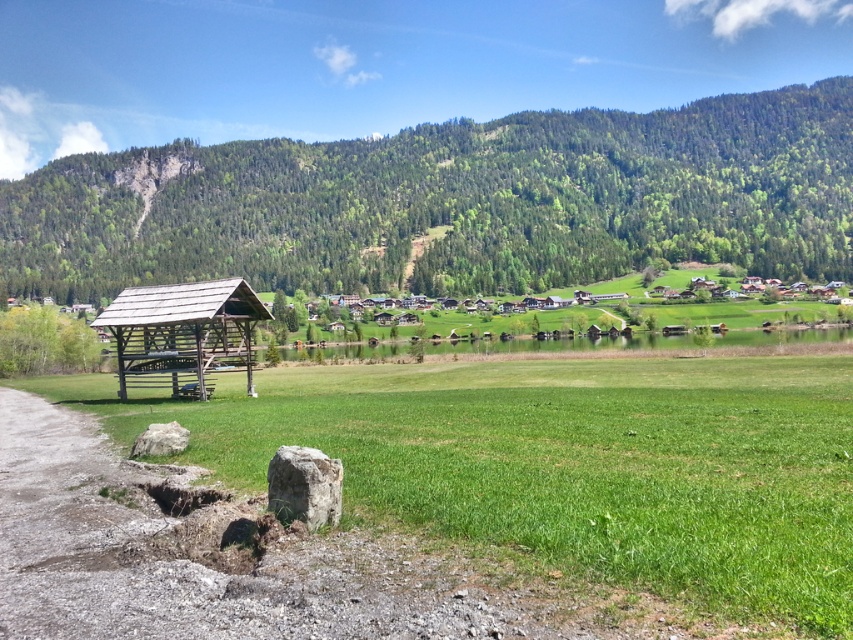
Does green forested mountain at upper center appear under wooden shed at left?

No.

Is point (766, 148) farther from camera compared to point (173, 365)?

Yes.

Find the location of a particular element. This screenshot has width=853, height=640. green forested mountain at upper center is located at coordinates (453, 202).

Which is more to the left, green grassy field at center or wooden shed at left?

Positioned to the left is wooden shed at left.

Can you confirm if green grassy field at center is thinner than wooden shed at left?

In fact, green grassy field at center might be wider than wooden shed at left.

At what (x,y) coordinates should I click in order to perform the action: click on green grassy field at center. Please return your answer as a coordinate pair (x, y). This screenshot has width=853, height=640. Looking at the image, I should click on (575, 461).

Who is shorter, green forested mountain at upper center or green grassy field at center?

Standing shorter between the two is green grassy field at center.

Between green forested mountain at upper center and green grassy field at center, which one appears on the right side from the viewer's perspective?

green forested mountain at upper center is more to the right.

Describe the element at coordinates (453, 202) in the screenshot. I see `green forested mountain at upper center` at that location.

The width and height of the screenshot is (853, 640). Find the location of `green forested mountain at upper center`. green forested mountain at upper center is located at coordinates (453, 202).